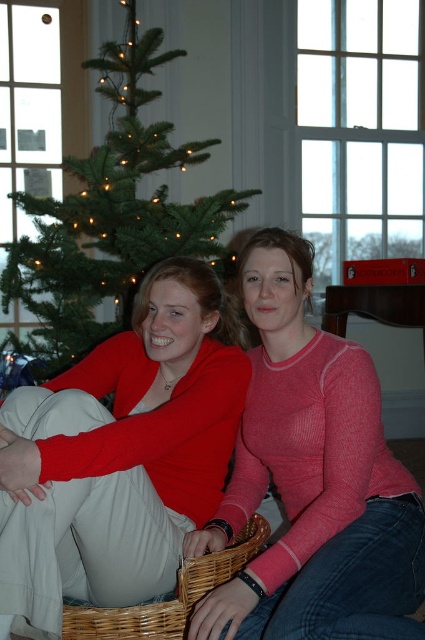
Question: Is pink ribbed sweater at center closer to the viewer compared to woven brown basket at lower center?

Choices:
 (A) no
 (B) yes

Answer: (B)

Question: Which object is farther from the camera taking this photo?

Choices:
 (A) pink ribbed sweater at center
 (B) green matte christmas tree at center
 (C) matte red sweater at center
 (D) woven brown basket at lower center

Answer: (B)

Question: Is matte red sweater at center smaller than woven brown basket at lower center?

Choices:
 (A) yes
 (B) no

Answer: (B)

Question: Observing the image, what is the correct spatial positioning of matte red sweater at center in reference to green matte christmas tree at center?

Choices:
 (A) right
 (B) left

Answer: (A)

Question: Which object appears farthest from the camera in this image?

Choices:
 (A) pink ribbed sweater at center
 (B) matte red sweater at center
 (C) woven brown basket at lower center
 (D) green matte christmas tree at center

Answer: (D)

Question: Which object is the closest to the pink ribbed sweater at center?

Choices:
 (A) green matte christmas tree at center
 (B) woven brown basket at lower center
 (C) matte red sweater at center

Answer: (B)